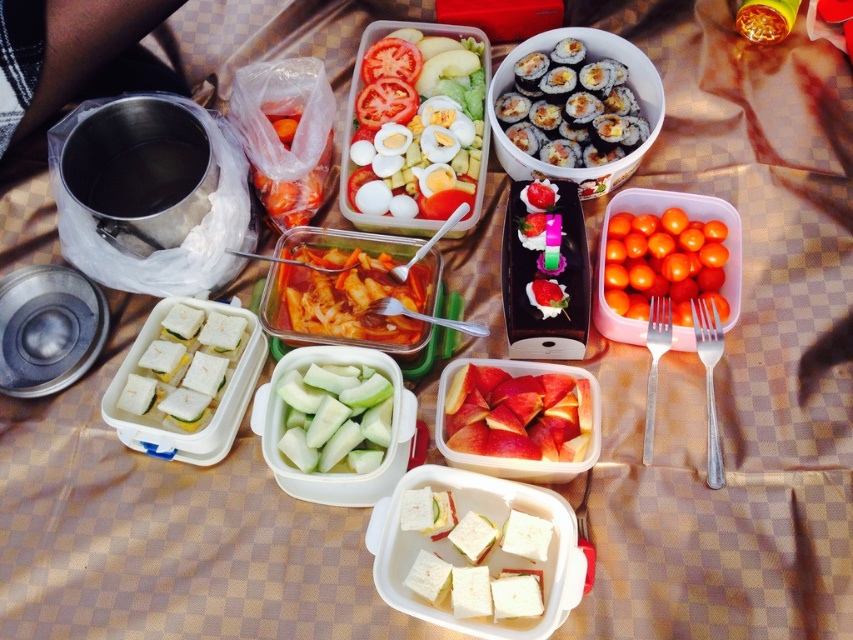
Question: Which of the following is the farthest from the observer?

Choices:
 (A) (643, 228)
 (B) (358, 282)
 (C) (523, 605)

Answer: (B)

Question: Among these points, which one is nearest to the camera?

Choices:
 (A) (386, 396)
 (B) (668, 280)

Answer: (A)

Question: Is white sandwich at center further to camera compared to pink matte apple slices at center?

Choices:
 (A) no
 (B) yes

Answer: (B)

Question: Which of the following is the farthest from the observer?

Choices:
 (A) green matte cucumber at center
 (B) pink matte apple slices at center

Answer: (A)

Question: Is pink matte apple slices at center to the right of green matte cucumber at center from the viewer's perspective?

Choices:
 (A) no
 (B) yes

Answer: (B)

Question: Can you confirm if white sandwich at center is positioned to the left of green matte cucumber at center?

Choices:
 (A) yes
 (B) no

Answer: (A)